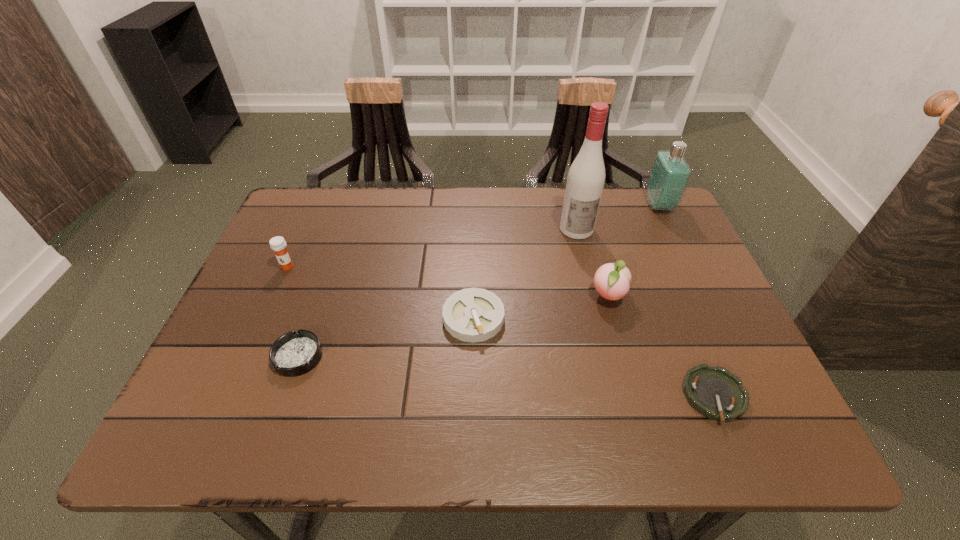
The height and width of the screenshot is (540, 960). I want to click on the closest ashtray relative to the second ashtray from right to left, so click(295, 353).

The width and height of the screenshot is (960, 540). Identify the location of free location that satisfies the following two spatial constraints: 1. on the front label of the farthest object; 2. on the label side of the medicine. (688, 267).

Locate an element on the screen. free location that satisfies the following two spatial constraints: 1. on the label side of the tallest ashtray; 2. on the left side of the medicine is located at coordinates (265, 318).

The image size is (960, 540). I want to click on vacant space that satisfies the following two spatial constraints: 1. on the label of the shortest ashtray; 2. on the right side of the sixth nearest object, so click(x=617, y=396).

At what (x,y) coordinates should I click in order to perform the action: click on free region that satisfies the following two spatial constraints: 1. on the label of the peach; 2. on the left side of the second farthest object. Please return your answer as a coordinate pair (x, y). Image resolution: width=960 pixels, height=540 pixels. Looking at the image, I should click on pyautogui.click(x=593, y=296).

The width and height of the screenshot is (960, 540). Identify the location of vacant space that satisfies the following two spatial constraints: 1. on the label side of the medicine; 2. on the left side of the third shortest object. (265, 318).

Find the location of `free space that satisfies the following two spatial constraints: 1. on the front label of the farthest object; 2. on the label of the sixth nearest object`. free space that satisfies the following two spatial constraints: 1. on the front label of the farthest object; 2. on the label of the sixth nearest object is located at coordinates (671, 230).